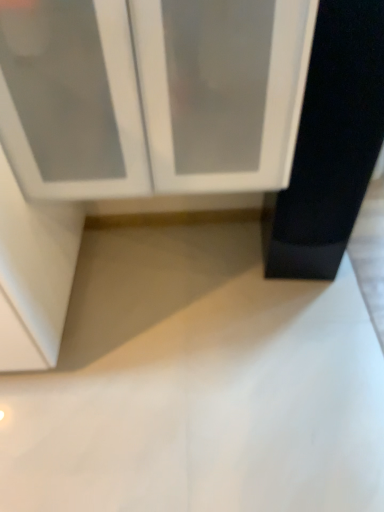
Locate an element on the screen. The height and width of the screenshot is (512, 384). free space above white glossy cabinet at upper center (from a real-world perspective) is located at coordinates (187, 316).